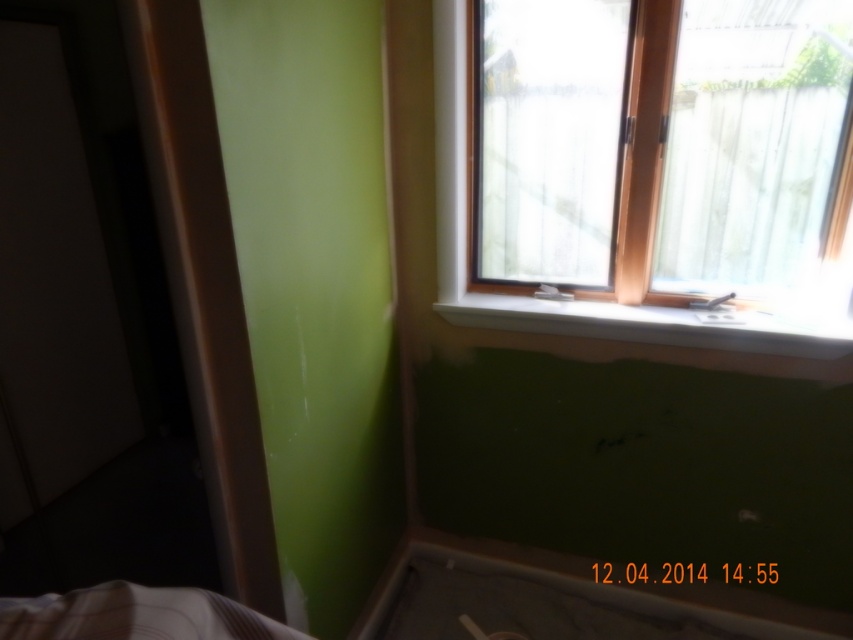
Question: Among these objects, which one is farthest from the camera?

Choices:
 (A) wooden frame at upper right
 (B) white smooth window sill at upper center

Answer: (A)

Question: Can you confirm if wooden frame at upper right is positioned to the right of white smooth window sill at upper center?

Choices:
 (A) no
 (B) yes

Answer: (A)

Question: Which of the following is the closest to the observer?

Choices:
 (A) (457, 252)
 (B) (492, 301)

Answer: (A)

Question: Can you confirm if wooden frame at upper right is positioned to the left of white smooth window sill at upper center?

Choices:
 (A) no
 (B) yes

Answer: (B)

Question: Among these points, which one is nearest to the camera?

Choices:
 (A) coord(482,307)
 (B) coord(618,332)

Answer: (B)

Question: Is wooden frame at upper right to the left of white smooth window sill at upper center from the viewer's perspective?

Choices:
 (A) no
 (B) yes

Answer: (B)